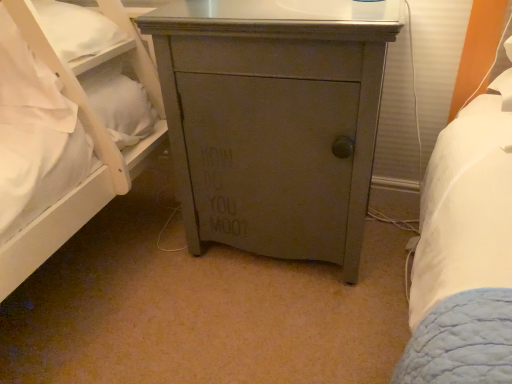
Identify the location of free space to the left of matte gray cabinet at center. (126, 263).